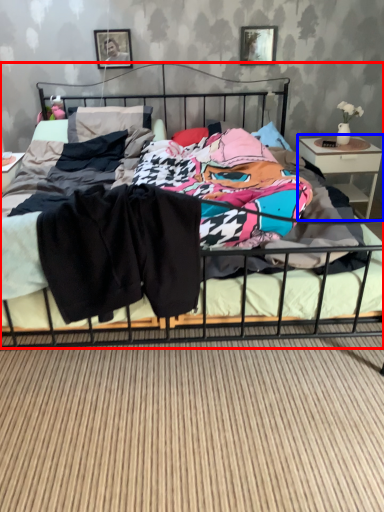
Question: Which object appears farthest to the camera in this image, bed (highlighted by a red box) or nightstand (highlighted by a blue box)?

Choices:
 (A) bed
 (B) nightstand

Answer: (B)